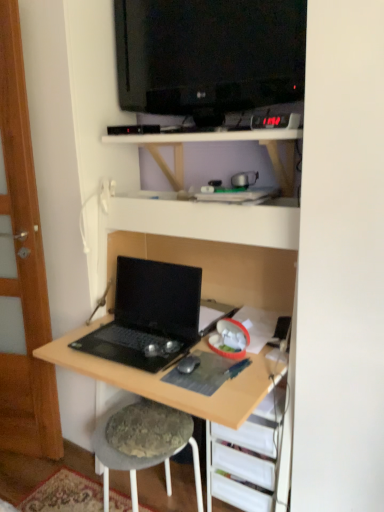
The width and height of the screenshot is (384, 512). What do you see at coordinates (149, 315) in the screenshot? I see `black matte laptop at lower left` at bounding box center [149, 315].

Where is `wooden desk at lower right, the first shelf from the bottom`? wooden desk at lower right, the first shelf from the bottom is located at coordinates (247, 457).

Would you say white matte shelf at upper center, placed as the second shelf when sorted from bottom to top, is inside or outside black matte laptop at lower left?

white matte shelf at upper center, placed as the second shelf when sorted from bottom to top, cannot be found inside black matte laptop at lower left.

Is white matte shelf at upper center, placed as the second shelf when sorted from bottom to top, bigger than black matte laptop at lower left?

Yes.

Is white matte shelf at upper center, placed as the first shelf when sorted from top to bottom, positioned behind black matte laptop at lower left?

That is False.

Is textured gray stool at lower center oriented towards black glossy television at upper center?

No, textured gray stool at lower center does not turn towards black glossy television at upper center.

Which object is more forward, textured gray stool at lower center or black glossy television at upper center?

black glossy television at upper center.

What's the angular difference between textured gray stool at lower center and black glossy television at upper center's facing directions?

The facing directions of textured gray stool at lower center and black glossy television at upper center are 0.00144 degrees apart.

Consider the image. Which of these two, textured gray stool at lower center or black glossy television at upper center, is bigger?

textured gray stool at lower center.

What's the angular difference between black glossy television at upper center and white matte shelf at upper center, placed as the first shelf when sorted from top to bottom,'s facing directions?

They differ by 0.612 degrees in their facing directions.

Between black glossy television at upper center and white matte shelf at upper center, placed as the second shelf when sorted from bottom to top, which one is positioned in front?

black glossy television at upper center is more forward.

Is white matte shelf at upper center, placed as the second shelf when sorted from bottom to top, at the back of black glossy television at upper center?

No, white matte shelf at upper center, placed as the second shelf when sorted from bottom to top, is not at the back of black glossy television at upper center.

From the image's perspective, does black glossy television at upper center appear lower than white matte shelf at upper center, placed as the first shelf when sorted from top to bottom?

Incorrect, from the image's perspective, black glossy television at upper center is higher than white matte shelf at upper center, placed as the first shelf when sorted from top to bottom.

Find the location of a particular element. glass door below the white matte shelf at upper center, placed as the first shelf when sorted from top to bottom (from the image's perspective) is located at coordinates (24, 267).

Between white matte shelf at upper center, placed as the second shelf when sorted from bottom to top, and transparent wood door at left, which one is positioned behind?

transparent wood door at left is behind.

Is white matte shelf at upper center, placed as the second shelf when sorted from bottom to top, facing towards transparent wood door at left?

No, white matte shelf at upper center, placed as the second shelf when sorted from bottom to top, is not turned towards transparent wood door at left.

From a real-world perspective, is transparent wood door at left above or below wooden desk at lower right, the first shelf from the bottom?

transparent wood door at left is situated higher than wooden desk at lower right, the first shelf from the bottom, in the real world.

Between transparent wood door at left and wooden desk at lower right, the second shelf from the top, which one has smaller width?

With smaller width is transparent wood door at left.

Is point (12, 411) positioned in front of point (211, 479)?

No, (12, 411) is further to viewer.

From the image's perspective, is transparent wood door at left above wooden desk at lower right, the second shelf from the top?

Yes.

Identify the location of mouse behind the black glossy television at upper center. (188, 364).

Is point (178, 368) closer or farther from the camera than point (145, 53)?

Point (178, 368) is positioned closer to the camera compared to point (145, 53).

Is black glossy television at upper center at the back of black matte mouse at center?

No, black glossy television at upper center is not at the back of black matte mouse at center.

Is black matte mouse at center wider than black glossy television at upper center?

Yes.

How far apart are black matte laptop at lower left and black glossy television at upper center?

The distance of black matte laptop at lower left from black glossy television at upper center is 31.58 inches.

In terms of width, does black matte laptop at lower left look wider or thinner when compared to black glossy television at upper center?

Clearly, black matte laptop at lower left has more width compared to black glossy television at upper center.

Considering the relative sizes of black matte laptop at lower left and black glossy television at upper center in the image provided, is black matte laptop at lower left smaller than black glossy television at upper center?

Actually, black matte laptop at lower left might be larger than black glossy television at upper center.

Is black matte laptop at lower left aimed at black glossy television at upper center?

No, black matte laptop at lower left does not turn towards black glossy television at upper center.

The width and height of the screenshot is (384, 512). I want to click on laptop behind the white matte shelf at upper center, placed as the first shelf when sorted from top to bottom, so click(149, 315).

The height and width of the screenshot is (512, 384). I want to click on television on the right of the textured gray stool at lower center, so click(x=209, y=56).

When comparing their distances from transparent wood door at left, does black glossy television at upper center or black matte mouse at center seem further?

black matte mouse at center is further to transparent wood door at left.

From the picture: From the image, which object appears to be farther from black matte laptop at lower left, black glossy television at upper center or wooden desk at lower right, the first shelf from the bottom?

black glossy television at upper center is further to black matte laptop at lower left.

When comparing their distances from black matte laptop at lower left, does textured gray stool at lower center or black glossy television at upper center seem closer?

Based on the image, textured gray stool at lower center appears to be nearer to black matte laptop at lower left.

From the image, which object appears to be nearer to textured gray stool at lower center, black matte laptop at lower left or black matte mouse at center?

Among the two, black matte laptop at lower left is located nearer to textured gray stool at lower center.

Looking at the image, which one is located further to black matte laptop at lower left, wooden desk at lower right, the second shelf from the top, or black matte mouse at center?

wooden desk at lower right, the second shelf from the top, is positioned further to the anchor black matte laptop at lower left.

Based on their spatial positions, is transparent wood door at left or black glossy television at upper center further from textured gray stool at lower center?

The object further to textured gray stool at lower center is black glossy television at upper center.

From the image, which object appears to be farther from black matte mouse at center, white matte shelf at upper center, placed as the first shelf when sorted from top to bottom, or textured gray stool at lower center?

Among the two, white matte shelf at upper center, placed as the first shelf when sorted from top to bottom, is located further to black matte mouse at center.

Looking at the image, which one is located further to textured gray stool at lower center, wooden desk at lower right, the second shelf from the top, or black matte mouse at center?

black matte mouse at center is further to textured gray stool at lower center.

The height and width of the screenshot is (512, 384). What are the coordinates of `laptop located between transparent wood door at left and wooden desk at lower right, the second shelf from the top, in the left-right direction` in the screenshot? It's located at (149, 315).

Find the location of a particular element. The height and width of the screenshot is (512, 384). shelf between black glossy television at upper center and wooden desk at lower right, the first shelf from the bottom, in the vertical direction is located at coordinates (213, 222).

Where is `mouse between transparent wood door at left and wooden desk at lower right, the second shelf from the top, from left to right`? mouse between transparent wood door at left and wooden desk at lower right, the second shelf from the top, from left to right is located at coordinates (188, 364).

At what (x,y) coordinates should I click in order to perform the action: click on laptop between black glossy television at upper center and wooden desk at lower right, the first shelf from the bottom, from top to bottom. Please return your answer as a coordinate pair (x, y). The image size is (384, 512). Looking at the image, I should click on (149, 315).